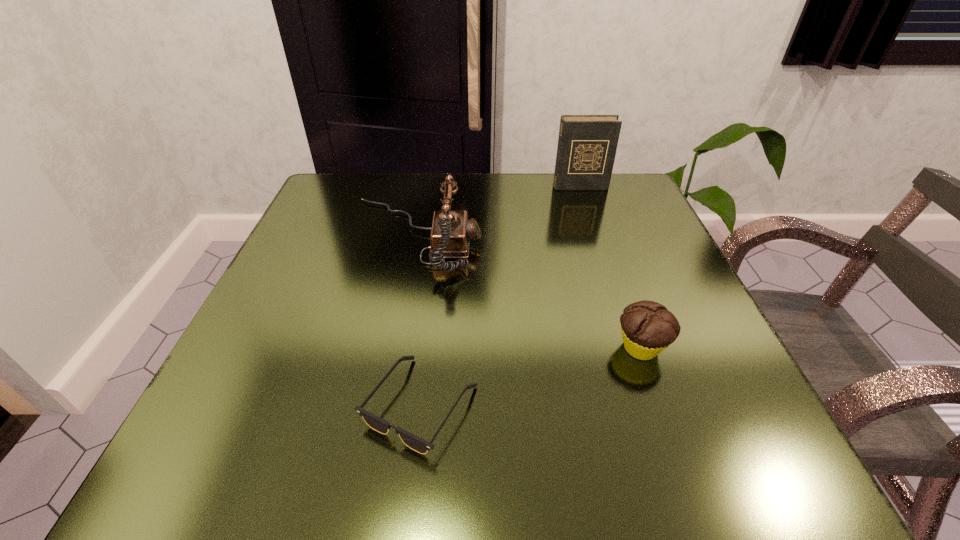
The width and height of the screenshot is (960, 540). Find the location of `free location that satisfies the following two spatial constraints: 1. on the front cover of the tallest object; 2. on the dial of the third shortest object`. free location that satisfies the following two spatial constraints: 1. on the front cover of the tallest object; 2. on the dial of the third shortest object is located at coordinates (596, 237).

Where is `blank space that satisfies the following two spatial constraints: 1. on the front cover of the diary; 2. on the dial of the third nearest object`? This screenshot has height=540, width=960. blank space that satisfies the following two spatial constraints: 1. on the front cover of the diary; 2. on the dial of the third nearest object is located at coordinates pyautogui.click(x=596, y=237).